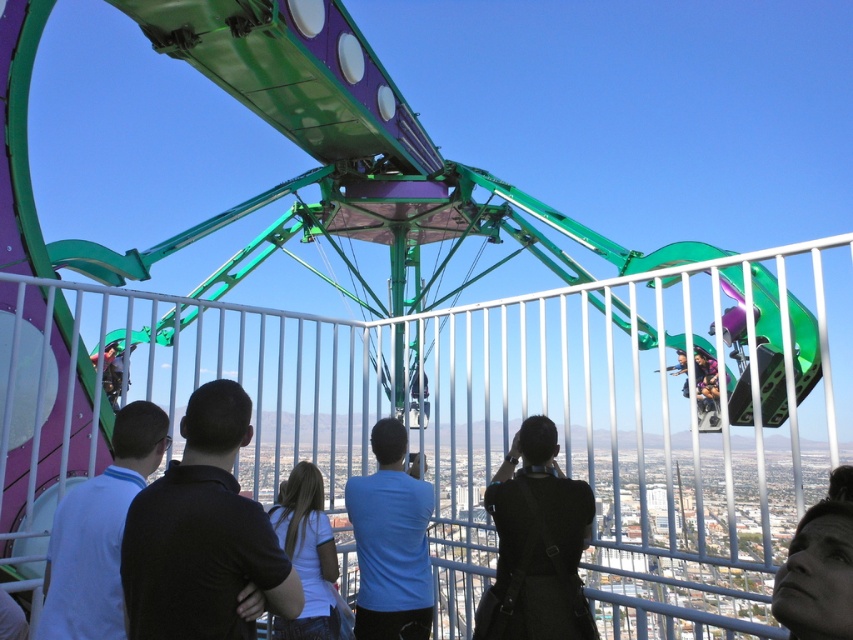
Question: Considering the relative positions of black shirt at center and blue matte shirt at center in the image provided, where is black shirt at center located with respect to blue matte shirt at center?

Choices:
 (A) below
 (B) above

Answer: (B)

Question: Which point is farther to the camera?

Choices:
 (A) black fabric camera at center
 (B) blue matte shirt at center
 (C) black shirt at center
 (D) smooth skin face at lower right

Answer: (B)

Question: Is black shirt at center above white matte shirt at center?

Choices:
 (A) yes
 (B) no

Answer: (A)

Question: Which of the following is the farthest from the observer?

Choices:
 (A) (424, 483)
 (B) (173, 508)
 (C) (314, 532)
 (D) (61, 588)

Answer: (A)

Question: Which of these objects is positioned closest to the white matte shirt at center?

Choices:
 (A) black shirt at center
 (B) blue matte shirt at center

Answer: (B)

Question: Is smooth skin face at lower right to the right of white matte shirt at center from the viewer's perspective?

Choices:
 (A) no
 (B) yes

Answer: (B)